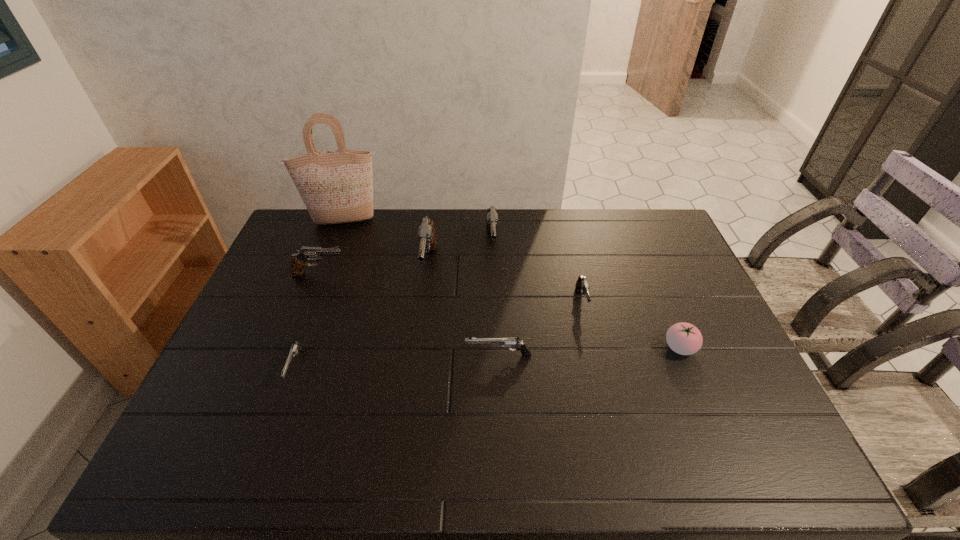
In the image, there is a desktop. Identify the location of free region at the far edge. coord(419,247).

This screenshot has height=540, width=960. In order to click on free space at the near edge of the desktop in this screenshot , I will do `click(708, 455)`.

This screenshot has height=540, width=960. Identify the location of blank space at the left edge of the desktop. (218, 392).

Where is `vacant area at the right edge of the desktop`? The width and height of the screenshot is (960, 540). vacant area at the right edge of the desktop is located at coordinates (665, 270).

The height and width of the screenshot is (540, 960). Find the location of `free space at the far right corner of the desktop`. free space at the far right corner of the desktop is located at coordinates (647, 215).

The height and width of the screenshot is (540, 960). In order to click on unoccupied area between the fourth tallest object and the rightmost object in this screenshot , I will do `click(499, 311)`.

Find the location of a particular element. Image resolution: width=960 pixels, height=540 pixels. vacant point located between the third gray pistol from left to right and the third pistol from left to right is located at coordinates (460, 256).

Where is `empty space between the third tallest pistol and the second tallest pistol`? The width and height of the screenshot is (960, 540). empty space between the third tallest pistol and the second tallest pistol is located at coordinates (405, 260).

At what (x,y) coordinates should I click in order to perform the action: click on free area in between the third biggest gray pistol and the rightmost gray pistol. Please return your answer as a coordinate pair (x, y). Looking at the image, I should click on [x=450, y=288].

Where is `free space between the smallest gray pistol and the tallest pistol`? free space between the smallest gray pistol and the tallest pistol is located at coordinates (505, 284).